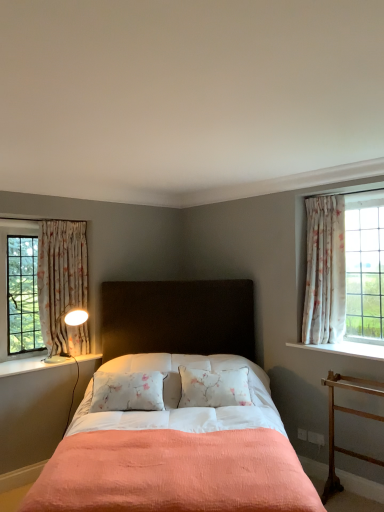
The width and height of the screenshot is (384, 512). I want to click on vacant space to the right of floral fabric curtain at right, the second curtain viewed from the left, so click(x=362, y=344).